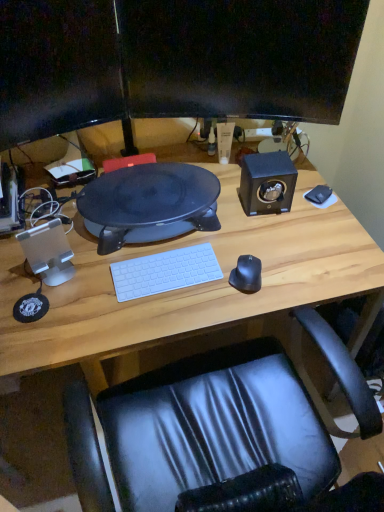
This screenshot has height=512, width=384. In order to click on free space that is in between black matte speaker at upper right, the 1th speaker when ordered from top to bottom, and black plastic computer at center in this screenshot , I will do `click(237, 203)`.